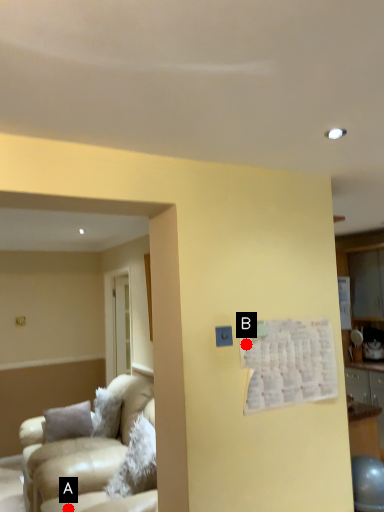
Question: Two points are circled on the image, labeled by A and B beside each circle. Which point is further to the camera?

Choices:
 (A) A is further
 (B) B is further

Answer: (A)